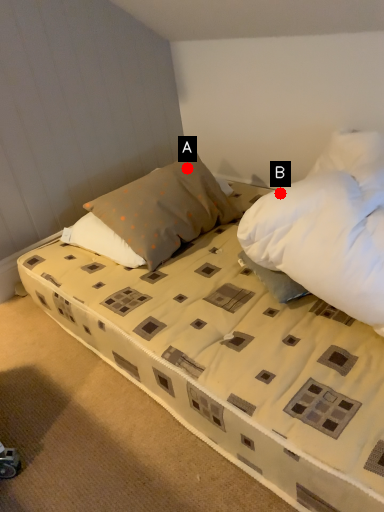
Question: Two points are circled on the image, labeled by A and B beside each circle. Which point is further to the camera?

Choices:
 (A) A is further
 (B) B is further

Answer: (A)